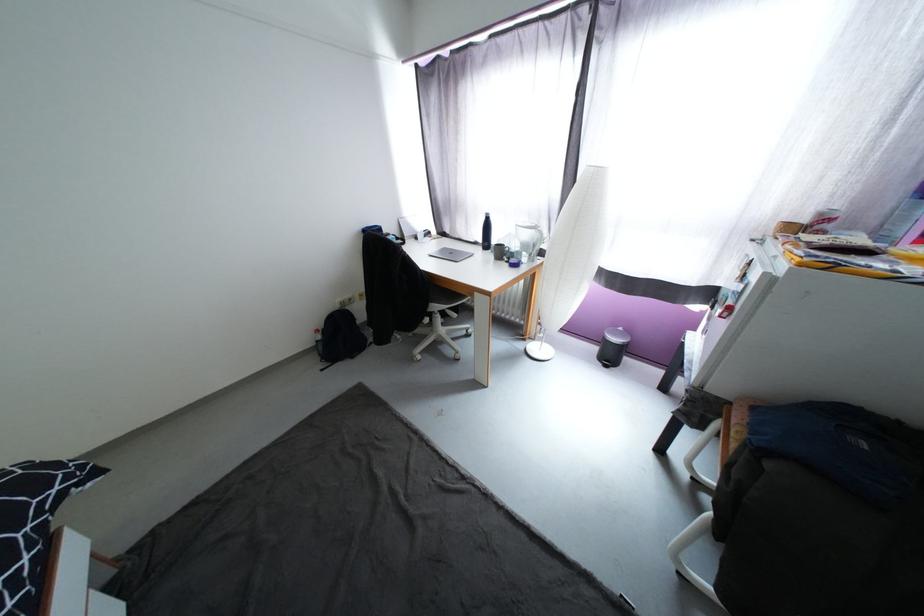
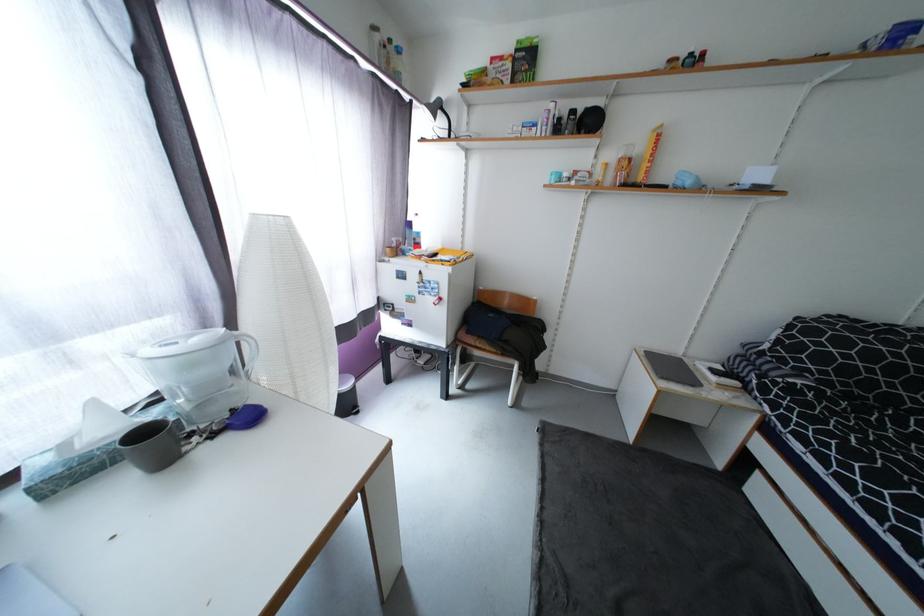
In the second image, find the point that corresponds to (739,448) in the first image.

(493, 349)